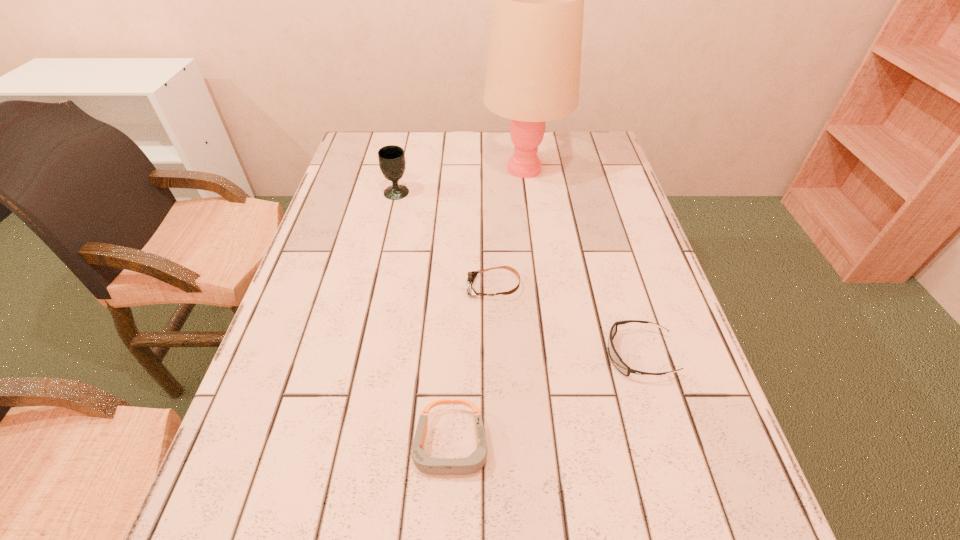
The height and width of the screenshot is (540, 960). Find the location of `the tallest object`. the tallest object is located at coordinates (534, 58).

Identify the location of the fourth shortest object. This screenshot has height=540, width=960. (392, 162).

Where is `the leftmost object`? the leftmost object is located at coordinates (392, 162).

The height and width of the screenshot is (540, 960). I want to click on the rightmost goggles, so click(620, 365).

Where is `the second nearest object`? the second nearest object is located at coordinates (620, 365).

I want to click on the nearest object, so click(435, 466).

Where is `the farthest goggles`? Image resolution: width=960 pixels, height=540 pixels. the farthest goggles is located at coordinates (471, 276).

Image resolution: width=960 pixels, height=540 pixels. Identify the location of free region located 0.320m on the left of the lampshade. (380, 168).

This screenshot has width=960, height=540. I want to click on free region located 0.300m on the front of the chalice, so click(378, 276).

This screenshot has width=960, height=540. In order to click on vacant area located on the lenses of the rightmost goggles in this screenshot , I will do `click(536, 355)`.